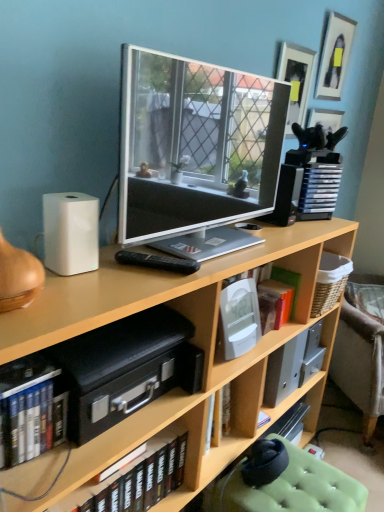
Question: Is orange matte book at center-right, arranged as the 3th book when ordered from the bottom, thinner than light brown wood bookcase at center?

Choices:
 (A) yes
 (B) no

Answer: (A)

Question: Is the position of orange matte book at center-right, positioned as the first book in right-to-left order, more distant than that of light brown wood bookcase at center?

Choices:
 (A) yes
 (B) no

Answer: (A)

Question: Is orange matte book at center-right, arranged as the 3th book when ordered from the bottom, turned away from light brown wood bookcase at center?

Choices:
 (A) no
 (B) yes

Answer: (B)

Question: From the image's perspective, is orange matte book at center-right, the 1th book from the back, located beneath light brown wood bookcase at center?

Choices:
 (A) yes
 (B) no

Answer: (B)

Question: Is green fabric swivel chair at lower right wider or thinner than white plastic speaker at right, which ranks as the first speaker in top-to-bottom order?

Choices:
 (A) wide
 (B) thin

Answer: (A)

Question: From the image's perspective, relative to white plastic speaker at right, which is the second speaker in bottom-to-top order, is green fabric swivel chair at lower right above or below?

Choices:
 (A) above
 (B) below

Answer: (B)

Question: Is point (273, 492) closer or farther from the camera than point (294, 192)?

Choices:
 (A) farther
 (B) closer

Answer: (B)

Question: In the image, is green fabric swivel chair at lower right positioned in front of or behind white plastic speaker at right, which appears as the 1th speaker when viewed from the back?

Choices:
 (A) behind
 (B) front

Answer: (B)

Question: Is matte black picture frame at upper right, the 2th picture frame from the left, situated inside hardcover books at lower left, which is counted as the 3th book, starting from the right, or outside?

Choices:
 (A) inside
 (B) outside

Answer: (B)

Question: Is matte black picture frame at upper right, which appears as the first picture frame when viewed from the right, in front of or behind hardcover books at lower left, marked as the 1th book in a front-to-back arrangement, in the image?

Choices:
 (A) behind
 (B) front

Answer: (A)

Question: Considering the positions of matte black picture frame at upper right, the 2th picture frame from the left, and hardcover books at lower left, marked as the 1th book in a front-to-back arrangement, in the image, is matte black picture frame at upper right, the 2th picture frame from the left, bigger or smaller than hardcover books at lower left, marked as the 1th book in a front-to-back arrangement,?

Choices:
 (A) small
 (B) big

Answer: (A)

Question: Would you say matte black picture frame at upper right, which appears as the first picture frame when viewed from the right, is to the left or to the right of hardcover books at lower left, which is counted as the 3th book, starting from the right, in the picture?

Choices:
 (A) right
 (B) left

Answer: (A)

Question: Is point (46, 411) closer or farther from the camera than point (291, 186)?

Choices:
 (A) closer
 (B) farther

Answer: (A)

Question: Is hardcover books at lower left, arranged as the second book when ordered from the bottom, taller or shorter than white plastic speaker at right, marked as the first speaker in a right-to-left arrangement?

Choices:
 (A) tall
 (B) short

Answer: (B)